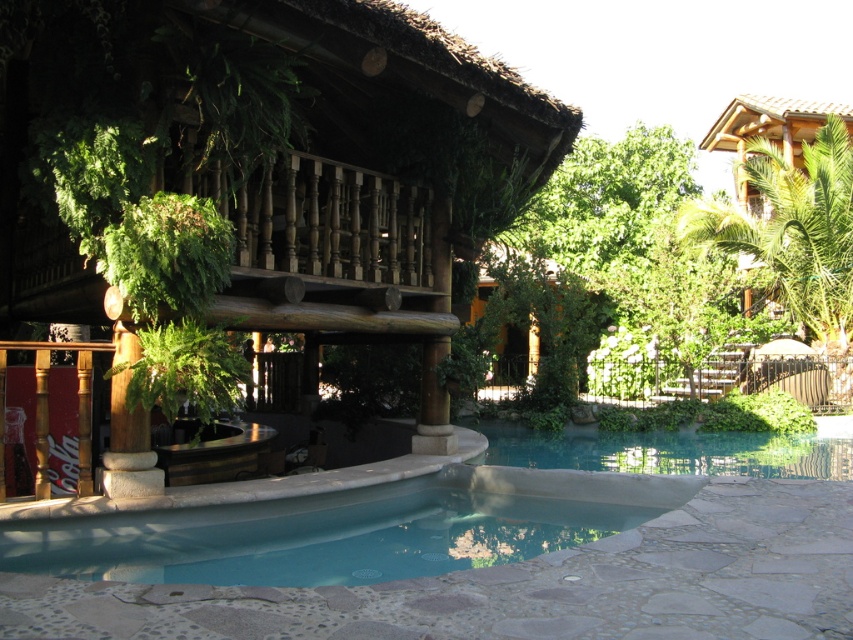
Question: Is green leafy tree at center above blue smooth water at center?

Choices:
 (A) yes
 (B) no

Answer: (A)

Question: Which is nearer to the wooden balcony at center?

Choices:
 (A) green leafy tree at upper right
 (B) green leafy tree at center

Answer: (B)

Question: Can you confirm if green leafy tree at center is positioned above green leafy tree at upper right?

Choices:
 (A) yes
 (B) no

Answer: (A)

Question: Does wooden balcony at center come in front of green leafy tree at upper right?

Choices:
 (A) no
 (B) yes

Answer: (B)

Question: Which point is closer to the camera taking this photo?

Choices:
 (A) (543, 189)
 (B) (824, 312)
 (C) (234, 184)

Answer: (C)

Question: Which point is farther to the camera?

Choices:
 (A) (302, 525)
 (B) (653, 451)

Answer: (B)